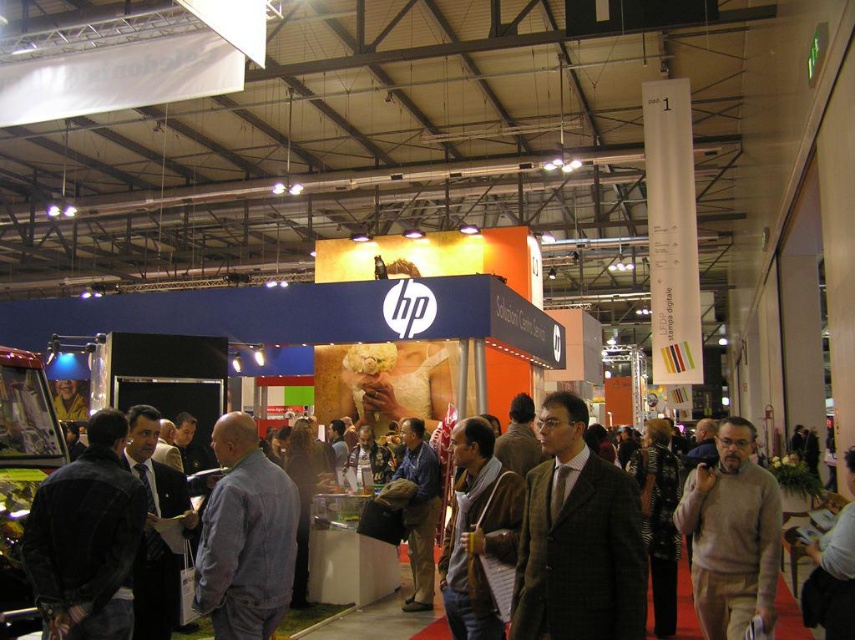
You are an event organizer who needs to place a large promotional banner between the dark blue denim jacket at left and the knitted sweater at center. Based on their sizes, which object should the banner be placed closer to?

The dark blue denim jacket at left is smaller than the knitted sweater at center, so the banner should be placed closer to the knitted sweater at center to ensure visibility.

You are at the HP Solutions Center booth and see a denim jacket at center and a knitted sweater at center. Which one is positioned to the left?

The denim jacket at center is positioned to the left of the knitted sweater at center.